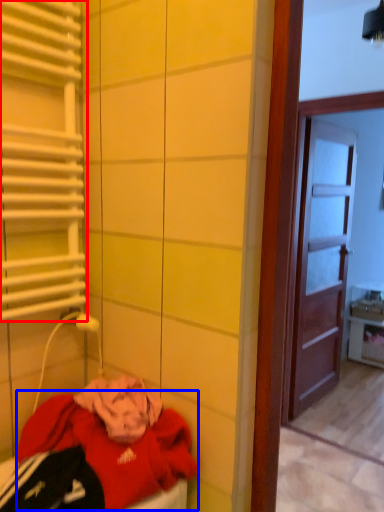
Question: Which object appears farthest to the camera in this image, shutter (highlighted by a red box) or clothing (highlighted by a blue box)?

Choices:
 (A) shutter
 (B) clothing

Answer: (A)